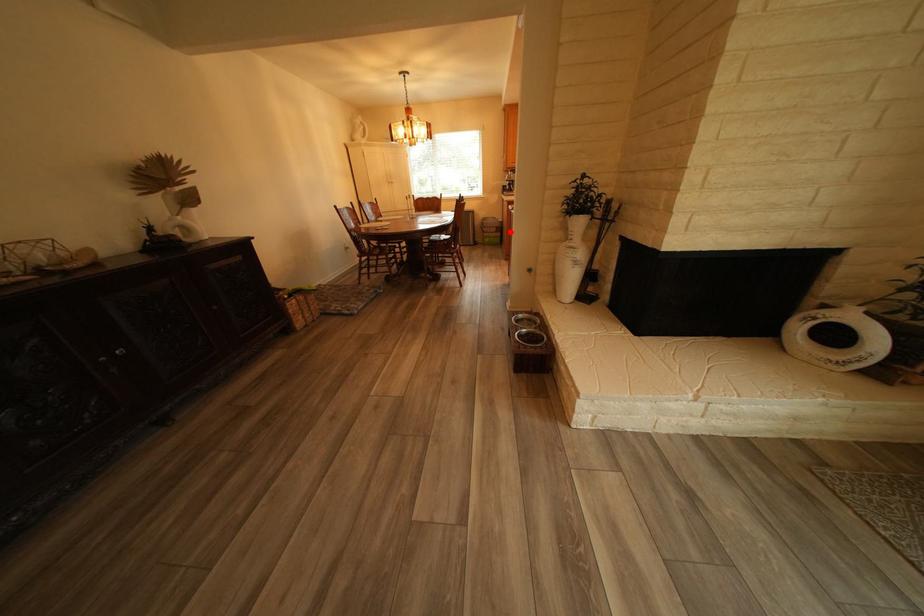
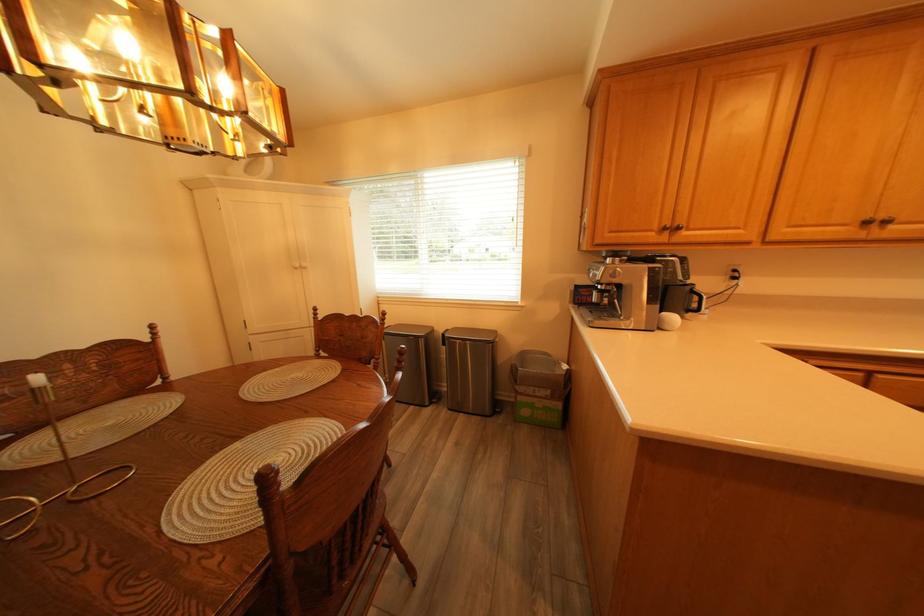
In the second image, find the point that corresponds to the highlighted location in the first image.

(566, 398)